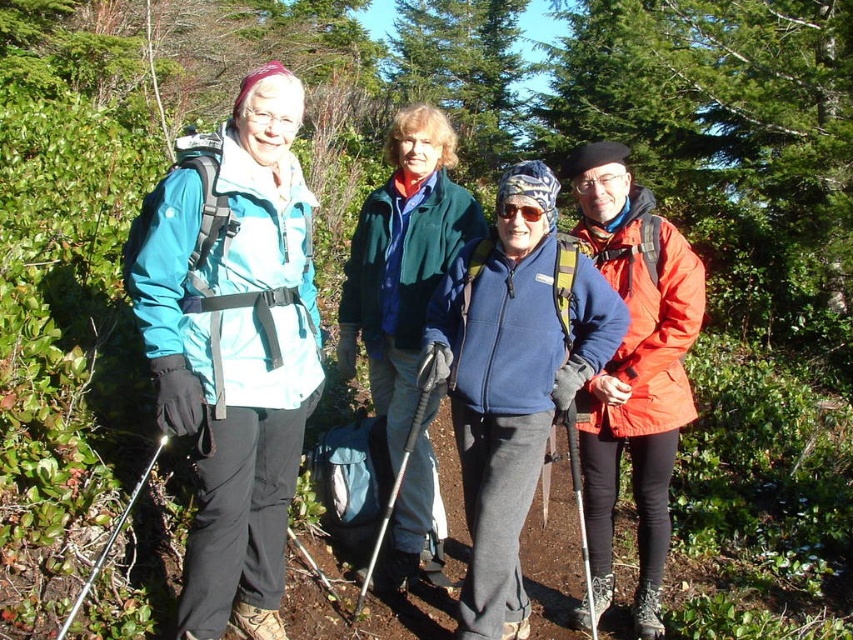
Question: Which object is positioned farthest from the matte orange jacket at right?

Choices:
 (A) teal matte jacket at left
 (B) green fleece jacket at center

Answer: (A)

Question: Is teal matte jacket at left to the right of matte orange jacket at right from the viewer's perspective?

Choices:
 (A) yes
 (B) no

Answer: (B)

Question: Among these objects, which one is farthest from the camera?

Choices:
 (A) green fleece jacket at center
 (B) teal matte jacket at left

Answer: (A)

Question: Is teal matte jacket at left further to camera compared to matte orange jacket at right?

Choices:
 (A) no
 (B) yes

Answer: (A)

Question: Which object is farther from the camera taking this photo?

Choices:
 (A) matte orange jacket at right
 (B) teal matte jacket at left
 (C) green fleece jacket at center

Answer: (C)

Question: Does teal matte jacket at left appear under matte orange jacket at right?

Choices:
 (A) no
 (B) yes

Answer: (A)